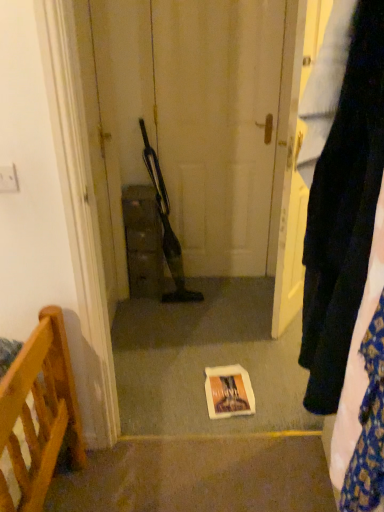
Question: Considering the relative positions of matte brown cabinet at center and velvet dark blue pants at right in the image provided, is matte brown cabinet at center to the left or to the right of velvet dark blue pants at right?

Choices:
 (A) right
 (B) left

Answer: (B)

Question: In the image, is matte brown cabinet at center positioned in front of or behind velvet dark blue pants at right?

Choices:
 (A) behind
 (B) front

Answer: (A)

Question: Considering the real-world distances, which object is farthest from the velvet dark blue pants at right?

Choices:
 (A) white paper bag at center
 (B) matte brown cabinet at center

Answer: (B)

Question: Based on their relative distances, which object is farther from the velvet dark blue pants at right?

Choices:
 (A) white paper bag at center
 (B) matte brown cabinet at center

Answer: (B)